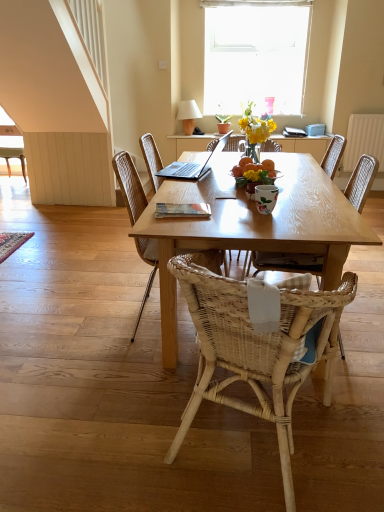
The width and height of the screenshot is (384, 512). I want to click on woven rattan chair at center, which ranks as the 2th chair in front-to-back order, so click(288, 263).

The width and height of the screenshot is (384, 512). Identify the location of green leafy plant at upper center. (223, 123).

Identify the location of white textured radiator at upper right. (364, 140).

The height and width of the screenshot is (512, 384). What are the coordinates of `satin silver laptop at center` in the screenshot? It's located at (194, 164).

Is woven wood chair at center, the third chair viewed from the right, located within green leafy plant at upper center?

That's incorrect, woven wood chair at center, the third chair viewed from the right, is not inside green leafy plant at upper center.

Who is shorter, green leafy plant at upper center or woven wood chair at center, positioned as the second chair in back-to-front order?

With less height is green leafy plant at upper center.

From a real-world perspective, who is located lower, green leafy plant at upper center or woven wood chair at center, acting as the second chair starting from the left?

woven wood chair at center, acting as the second chair starting from the left, from a real-world perspective.

Does green leafy plant at upper center have a greater width compared to woven wood chair at center, the third chair viewed from the right?

No.

Which object is closer to the camera, woven rattan chair at center, positioned as the 4th chair in left-to-right order, or white fabric lampshade at upper center?

woven rattan chair at center, positioned as the 4th chair in left-to-right order, is in front.

Is woven rattan chair at center, which appears as the 1th chair when viewed from the right, aimed at white fabric lampshade at upper center?

No, woven rattan chair at center, which appears as the 1th chair when viewed from the right, does not turn towards white fabric lampshade at upper center.

Is woven rattan chair at center, which ranks as the 2th chair in front-to-back order, not near white fabric lampshade at upper center?

That's right, there is a large distance between woven rattan chair at center, which ranks as the 2th chair in front-to-back order, and white fabric lampshade at upper center.

Looking at this image, from a real-world perspective, is satin silver laptop at center physically above woven wood chair at center, the 3th chair in the front-to-back sequence?

Correct, in the physical world, satin silver laptop at center is higher than woven wood chair at center, the 3th chair in the front-to-back sequence.

In the scene shown: Which is correct: satin silver laptop at center is inside woven wood chair at center, positioned as the second chair in back-to-front order, or outside of it?

satin silver laptop at center lies outside woven wood chair at center, positioned as the second chair in back-to-front order.

From their relative heights in the image, would you say satin silver laptop at center is taller or shorter than woven wood chair at center, the 3th chair in the front-to-back sequence?

Considering their sizes, satin silver laptop at center has less height than woven wood chair at center, the 3th chair in the front-to-back sequence.

Would you consider satin silver laptop at center to be distant from woven wood chair at center, positioned as the second chair in back-to-front order?

No.

What's the angular difference between white glossy coffee cup at center and white textured curtain at upper center's facing directions?

The facing directions of white glossy coffee cup at center and white textured curtain at upper center are 95.3 degrees apart.

In the scene shown: How much distance is there between white glossy coffee cup at center and white textured curtain at upper center?

A distance of 16.28 feet exists between white glossy coffee cup at center and white textured curtain at upper center.

In the image, is white glossy coffee cup at center on the left side or the right side of white textured curtain at upper center?

In the image, white glossy coffee cup at center appears on the left side of white textured curtain at upper center.

Which is in front, point (264, 213) or point (300, 1)?

The point (264, 213) is closer.

Is the position of woven wood chair at center, acting as the second chair starting from the left, less distant than that of wooden book at center?

Yes, it is.

Is woven wood chair at center, the third chair viewed from the right, far away from wooden book at center?

No.

Does woven wood chair at center, acting as the second chair starting from the left, have a larger size compared to wooden book at center?

Correct, woven wood chair at center, acting as the second chair starting from the left, is larger in size than wooden book at center.

From a real-world perspective, which object stands above the other?

wooden book at center is physically above.

Considering their positions, is white textured curtain at upper center located in front of or behind white glass window at upper center?

Clearly, white textured curtain at upper center is in front of white glass window at upper center.

Is white textured curtain at upper center shorter than white glass window at upper center?

Yes.

How different are the orientations of white textured curtain at upper center and white glass window at upper center in degrees?

The angle between the facing direction of white textured curtain at upper center and the facing direction of white glass window at upper center is 0.73 degrees.

From the image's perspective, does white textured curtain at upper center appear lower than white glass window at upper center?

Incorrect, from the image's perspective, white textured curtain at upper center is higher than white glass window at upper center.

From the image's perspective, is white glossy coffee cup at center on top of white fabric lampshade at upper center?

Actually, white glossy coffee cup at center appears below white fabric lampshade at upper center in the image.

Is white glossy coffee cup at center positioned with its back to white fabric lampshade at upper center?

That's not correct — white glossy coffee cup at center is not looking away from white fabric lampshade at upper center.

From a real-world perspective, is white glossy coffee cup at center on top of white fabric lampshade at upper center?

Actually, white glossy coffee cup at center is physically below white fabric lampshade at upper center in the real world.

I want to click on the 2nd chair counting from the left of the green leafy plant at upper center, so click(130, 185).

Starting from the white fabric lampshade at upper center, which chair is the 2nd one in front? Please provide its 2D coordinates.

[(288, 263)]

Estimate the real-world distances between objects in this image. Which object is closer to white glossy coffee cup at center, white textured radiator at upper right or white textured curtain at upper center?

white textured radiator at upper right.

Looking at this image, from the image, which object appears to be nearer to wooden table at center, white glass window at upper center or green leafy plant at upper center?

→ green leafy plant at upper center is positioned closer to the anchor wooden table at center.

When comparing their distances from white textured radiator at upper right, does white glass window at upper center or satin silver laptop at center seem further?

Among the two, white glass window at upper center is located further to white textured radiator at upper right.

Looking at this image, based on their spatial positions, is woven wood chair at left, which appears as the 4th chair when viewed from the right, or woven rattan chair at center, which appears as the 1th chair when viewed from the right, closer to white glass window at upper center?

woven wood chair at left, which appears as the 4th chair when viewed from the right, is closer to white glass window at upper center.

Estimate the real-world distances between objects in this image. Which object is further from woven rattan chair at center, positioned as the 4th chair in left-to-right order, green leafy plant at upper center or woven wood chair at center, the first chair in the front-to-back sequence?

The object further to woven rattan chair at center, positioned as the 4th chair in left-to-right order, is green leafy plant at upper center.

Which object lies further to the anchor point green leafy plant at upper center, woven rattan chair at center, positioned as the 4th chair in left-to-right order, or wooden table at center?

Based on the image, woven rattan chair at center, positioned as the 4th chair in left-to-right order, appears to be further to green leafy plant at upper center.

Which object lies further to the anchor point white fabric lampshade at upper center, woven wood chair at left, which appears as the 4th chair when viewed from the right, or white glossy coffee cup at center?

Based on the image, white glossy coffee cup at center appears to be further to white fabric lampshade at upper center.

Based on their spatial positions, is white glass window at upper center or woven wood chair at center, the 3th chair in the front-to-back sequence, further from white glossy coffee cup at center?

white glass window at upper center is further to white glossy coffee cup at center.

This screenshot has width=384, height=512. I want to click on radiator located between wooden book at center and green leafy plant at upper center in the depth direction, so click(364, 140).

I want to click on coffee cup located between wooden table at center and white glass window at upper center in the depth direction, so click(266, 198).

This screenshot has height=512, width=384. What are the coordinates of `coffee cup between woven wood chair at center, the first chair in the front-to-back sequence, and woven wood chair at center, acting as the second chair starting from the left, along the z-axis` in the screenshot? It's located at (266, 198).

This screenshot has height=512, width=384. What are the coordinates of `desk located between woven wood chair at center, placed as the second chair when sorted from right to left, and wooden book at center in the depth direction` in the screenshot? It's located at (254, 226).